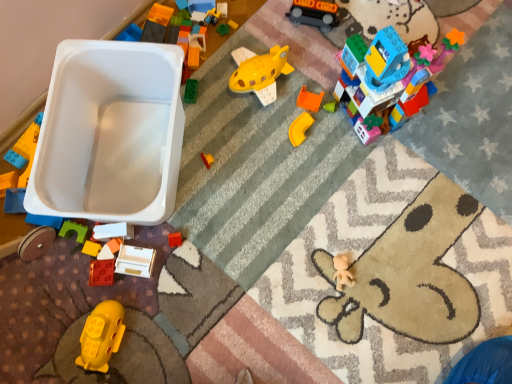
Identify the location of vacant space situated on the left part of yellow matte plastic corner piece at center-right, acting as the 6th toy starting from the left. This screenshot has height=384, width=512. (241, 136).